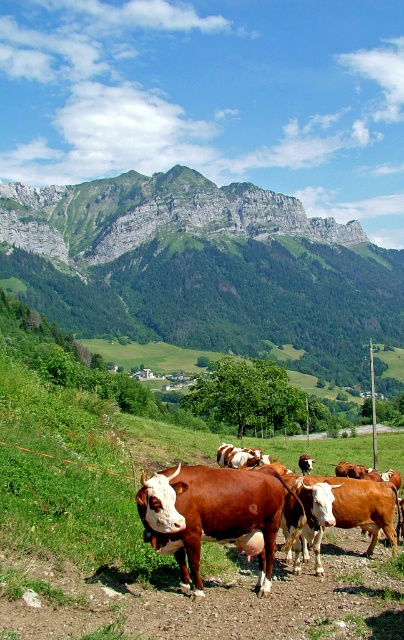
You are standing in the middle of the field and see the green rocky mountain at upper center and the brown glossy cow at center. Which object is located to the right of the other?

The green rocky mountain at upper center is positioned on the right side of brown glossy cow at center.

You are standing in the field and want to walk towards the rugged stone mountain at upper center. Which direction should you head relative to the brown glossy cow at center?

The rugged stone mountain at upper center is to the left of the brown glossy cow at center, so you should head left relative to the brown glossy cow at center to reach it.